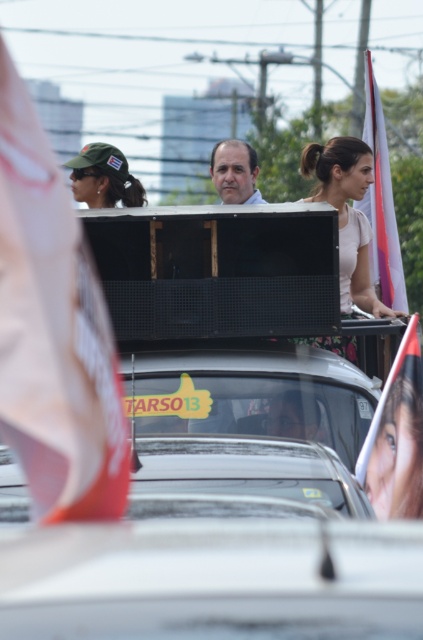
Question: Which point appears farthest from the camera in this image?

Choices:
 (A) (346, 269)
 (B) (107, 152)

Answer: (B)

Question: Is the position of green fabric flag at upper left more distant than that of white fabric flag at right?

Choices:
 (A) no
 (B) yes

Answer: (A)

Question: Considering the relative positions of smooth skin face at center and white fabric flag at right in the image provided, where is smooth skin face at center located with respect to white fabric flag at right?

Choices:
 (A) left
 (B) right

Answer: (A)

Question: Which object appears farthest from the camera in this image?

Choices:
 (A) smooth skin face at center
 (B) green fabric flag at upper left
 (C) pink fabric dress at center
 (D) green fabric cap at upper left

Answer: (D)

Question: From the image, what is the correct spatial relationship of smooth skin face at center in relation to white fabric flag at right?

Choices:
 (A) below
 (B) above

Answer: (A)

Question: Among these objects, which one is nearest to the camera?

Choices:
 (A) green fabric flag at upper left
 (B) white fabric flag at right

Answer: (A)